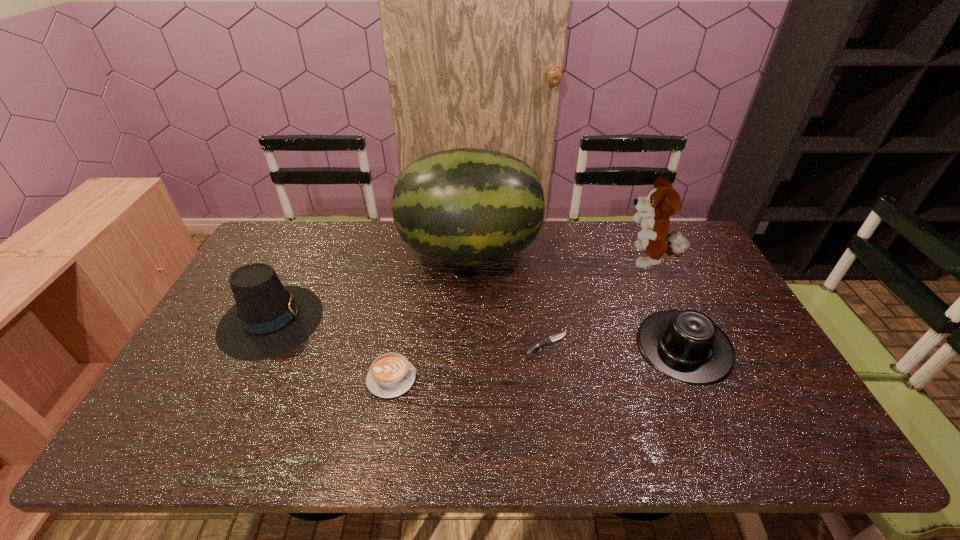
Locate an element on the screen. This screenshot has width=960, height=540. free spot located 0.270m on the face of the puppy is located at coordinates (540, 261).

Find the location of a particular element. Image resolution: width=960 pixels, height=540 pixels. free space located 0.190m on the face of the puppy is located at coordinates (564, 261).

The height and width of the screenshot is (540, 960). Find the location of `vacant space located 0.320m on the front-facing side of the fourth shortest object`. vacant space located 0.320m on the front-facing side of the fourth shortest object is located at coordinates (433, 320).

Where is `vacant region located 0.340m on the left of the fourth tallest object`? Image resolution: width=960 pixels, height=540 pixels. vacant region located 0.340m on the left of the fourth tallest object is located at coordinates (513, 347).

You are a GUI agent. You are given a task and a screenshot of the screen. Output one action in this format:
    pyautogui.click(x=<x>, y=<y>)
    Task: Click on the vacant space located 0.330m on the side of the cappuccino with the handle
    This screenshot has width=960, height=540.
    Given the screenshot: What is the action you would take?
    pyautogui.click(x=549, y=379)

At what (x,y) coordinates should I click in order to perform the action: click on vacant space located on the back of the pocketknife. Please return your answer as a coordinate pair (x, y). The height and width of the screenshot is (540, 960). Looking at the image, I should click on (538, 284).

This screenshot has height=540, width=960. I want to click on watermelon located in the far edge section of the desktop, so click(467, 206).

Where is `puppy situated at the far edge`? puppy situated at the far edge is located at coordinates (663, 201).

What are the coordinates of `object that is positioned at the left edge` in the screenshot? It's located at (269, 319).

Image resolution: width=960 pixels, height=540 pixels. Find the location of `puppy that is positioned at the right edge`. puppy that is positioned at the right edge is located at coordinates (663, 201).